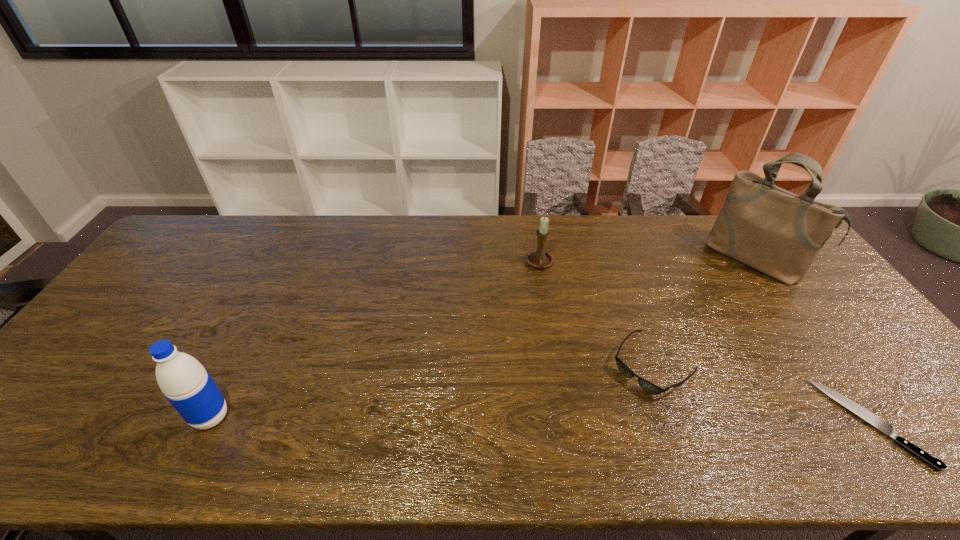
At what (x,y) coordinates should I click in order to perform the action: click on vacant area that lies between the shoulder bag and the leftmost object. Please return your answer as a coordinate pair (x, y). The image size is (960, 540). Looking at the image, I should click on (482, 338).

I want to click on vacant area that lies between the candle holder and the steak knife, so click(x=705, y=343).

Locate an element on the screen. This screenshot has height=540, width=960. object that stands as the second closest to the shortest object is located at coordinates (779, 233).

Identify which object is located as the second nearest to the third object from right to left. Please provide its 2D coordinates. Your answer should be formatted as a tuple, i.e. [(x, y)], where the tuple contains the x and y coordinates of a point satisfying the conditions above.

[(887, 428)]

Where is `free point that satisfies the following two spatial constraints: 1. on the back side of the steak knife; 2. on the right side of the shoulder bag`? The image size is (960, 540). free point that satisfies the following two spatial constraints: 1. on the back side of the steak knife; 2. on the right side of the shoulder bag is located at coordinates [x=754, y=260].

The image size is (960, 540). I want to click on free space in the image that satisfies the following two spatial constraints: 1. on the front side of the sunglasses; 2. on the right side of the steak knife, so click(x=673, y=422).

At what (x,y) coordinates should I click in order to perform the action: click on free space that satisfies the following two spatial constraints: 1. on the back side of the shortest object; 2. on the left side of the tallest object. Please return your answer as a coordinate pair (x, y). Looking at the image, I should click on (754, 260).